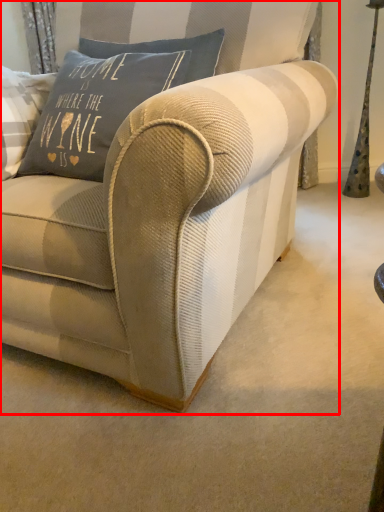
Question: From the image's perspective, what is the correct spatial positioning of studio couch (annotated by the red box) in reference to pillow?

Choices:
 (A) above
 (B) below

Answer: (B)